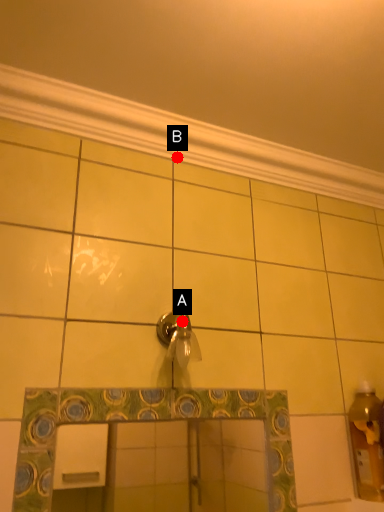
Question: Two points are circled on the image, labeled by A and B beside each circle. Which of the following is the closest to the observer?

Choices:
 (A) A is closer
 (B) B is closer

Answer: (A)